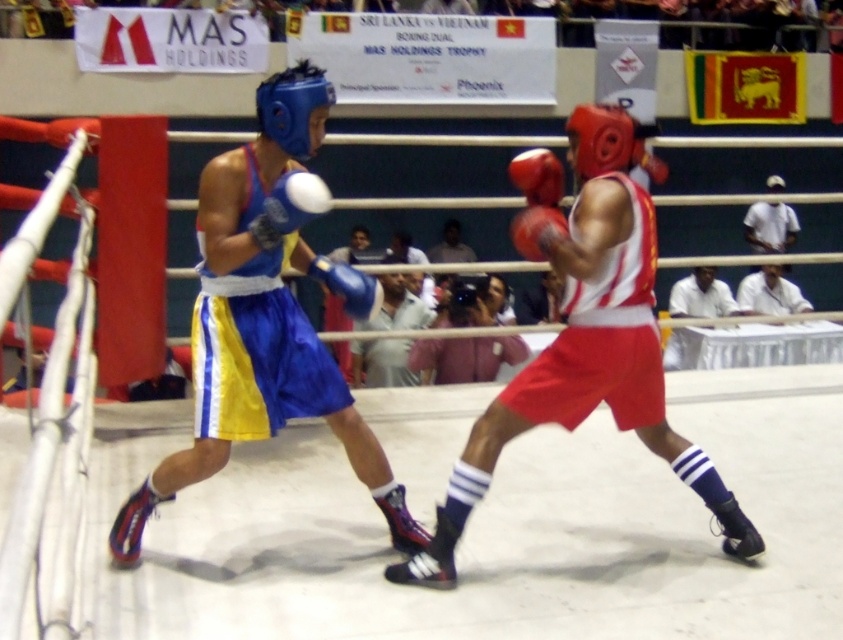
Between white cotton shirt at upper right and matte red boxing glove at center, which one appears on the right side from the viewer's perspective?

Positioned to the right is white cotton shirt at upper right.

Who is higher up, white cotton shirt at upper right or matte red boxing glove at center?

Positioned higher is matte red boxing glove at center.

Is point (750, 308) more distant than point (524, 253)?

Yes, it is behind point (524, 253).

Locate an element on the screen. The height and width of the screenshot is (640, 843). white cotton shirt at upper right is located at coordinates (771, 292).

Is matte red boxing glove at center closer to the viewer compared to white shirt at center?

Yes, matte red boxing glove at center is in front of white shirt at center.

Who is more distant from viewer, [557,209] or [464,244]?

Positioned behind is point [464,244].

Is point (557, 211) closer to viewer compared to point (466, 259)?

Yes, point (557, 211) is in front of point (466, 259).

At what (x,y) coordinates should I click in order to perform the action: click on matte red boxing glove at center. Please return your answer as a coordinate pair (x, y). Looking at the image, I should click on (535, 228).

Who is positioned more to the left, light gray cotton shirt at center or blue fabric shorts at center?

blue fabric shorts at center is more to the left.

This screenshot has height=640, width=843. Find the location of `light gray cotton shirt at center`. light gray cotton shirt at center is located at coordinates (380, 362).

Locate an element on the screen. light gray cotton shirt at center is located at coordinates (380, 362).